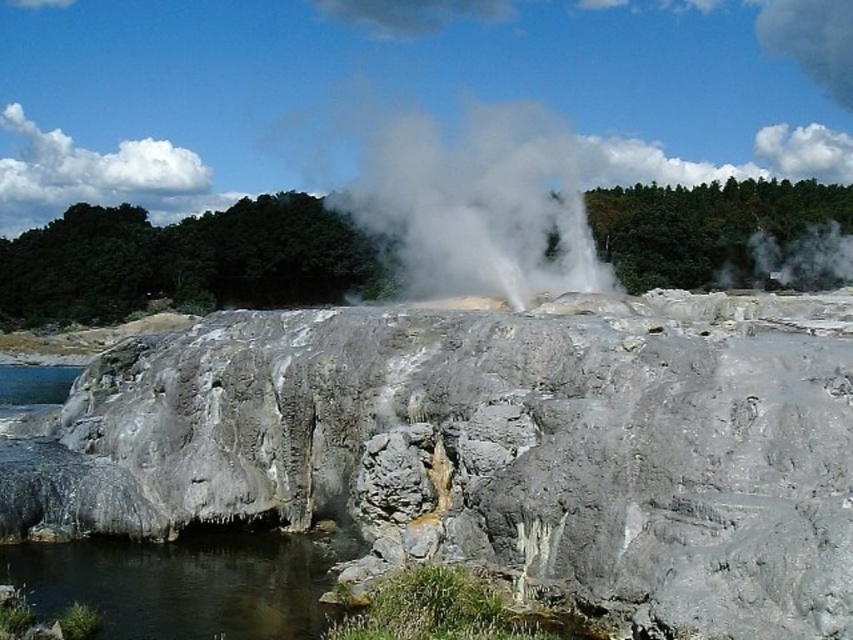
Question: In this image, where is gray rough cliff at center located relative to clear water at lower left?

Choices:
 (A) below
 (B) above

Answer: (B)

Question: Among these objects, which one is farthest from the camera?

Choices:
 (A) white vapor at center
 (B) gray rough cliff at center
 (C) gray rocky geyser at center

Answer: (C)

Question: Which point is closer to the camera?

Choices:
 (A) white vapor at center
 (B) gray rocky geyser at center
 (C) gray rough cliff at center

Answer: (C)

Question: Which of the following is the closest to the observer?

Choices:
 (A) white vapor at center
 (B) clear water at lower left

Answer: (B)

Question: Can you confirm if gray rocky geyser at center is bigger than white vapor at center?

Choices:
 (A) no
 (B) yes

Answer: (B)

Question: Can you confirm if white vapor at center is positioned to the right of clear water at lower left?

Choices:
 (A) no
 (B) yes

Answer: (B)